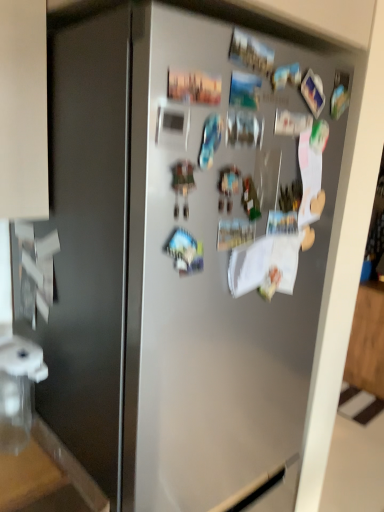
Question: Does clear plastic water filter at lower left have a smaller size compared to wooden countertop at lower left?

Choices:
 (A) no
 (B) yes

Answer: (A)

Question: Can you confirm if clear plastic water filter at lower left is thinner than wooden countertop at lower left?

Choices:
 (A) yes
 (B) no

Answer: (A)

Question: From the image's perspective, is clear plastic water filter at lower left below wooden countertop at lower left?

Choices:
 (A) no
 (B) yes

Answer: (A)

Question: Considering the relative sizes of clear plastic water filter at lower left and wooden countertop at lower left in the image provided, is clear plastic water filter at lower left bigger than wooden countertop at lower left?

Choices:
 (A) yes
 (B) no

Answer: (A)

Question: Is clear plastic water filter at lower left positioned with its back to wooden countertop at lower left?

Choices:
 (A) no
 (B) yes

Answer: (A)

Question: Could you tell me if clear plastic water filter at lower left is facing wooden countertop at lower left?

Choices:
 (A) no
 (B) yes

Answer: (A)

Question: Is wooden countertop at lower left taller than clear plastic water filter at lower left?

Choices:
 (A) no
 (B) yes

Answer: (A)

Question: Is the depth of wooden countertop at lower left greater than that of clear plastic water filter at lower left?

Choices:
 (A) yes
 (B) no

Answer: (B)

Question: Is there a large distance between wooden countertop at lower left and clear plastic water filter at lower left?

Choices:
 (A) yes
 (B) no

Answer: (B)

Question: Does wooden countertop at lower left appear on the right side of clear plastic water filter at lower left?

Choices:
 (A) yes
 (B) no

Answer: (B)

Question: From a real-world perspective, is wooden countertop at lower left on top of clear plastic water filter at lower left?

Choices:
 (A) no
 (B) yes

Answer: (A)

Question: Is wooden countertop at lower left wider than clear plastic water filter at lower left?

Choices:
 (A) yes
 (B) no

Answer: (A)

Question: In terms of width, does clear plastic water filter at lower left look wider or thinner when compared to wooden countertop at lower left?

Choices:
 (A) thin
 (B) wide

Answer: (A)